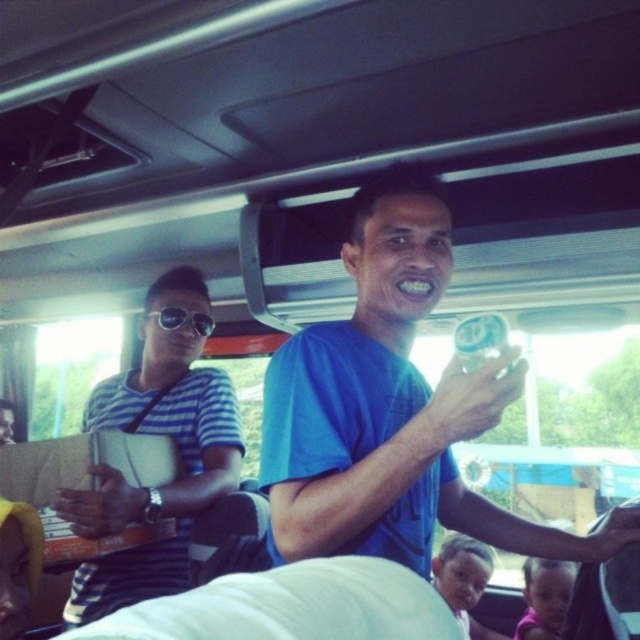
You are a passenger on a bus and want to know which object is located to the left between the striped fabric shirt at left and the black reflective sunglasses at upper center. Which one is more to the left?

The striped fabric shirt at left is more to the left than the black reflective sunglasses at upper center.

From the picture: You are a passenger on the bus and want to ask the person wearing the blue matte shirt at center a question. Which direction should you move to approach them from the black reflective sunglasses at upper center?

The blue matte shirt at center is positioned on the right side of the black reflective sunglasses at upper center. To approach the blue matte shirt at center from the black reflective sunglasses at upper center, you should move to the right.